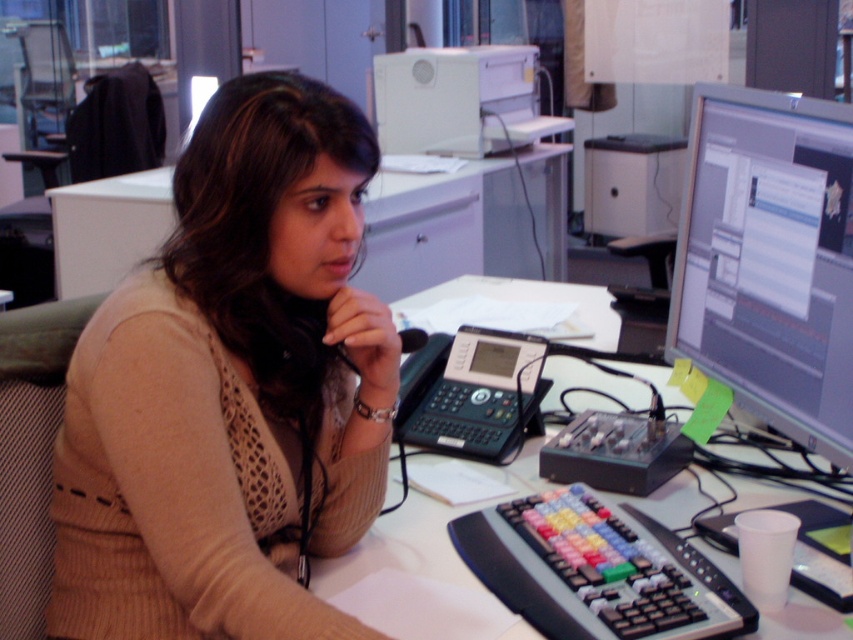
You are a delivery person who needs to place a small package on the white plastic table at center. The camera is positioned 1.01 meters away from the table. Can you safely place the package without moving the camera?

The white plastic table at center and camera are 1.01 meters apart from each other. Since the distance between them is exactly 1.01 meters, you can safely place the package on the white plastic table at center without disturbing the camera as long as you do not exceed that distance.

You are organizing an office space and need to place a new 12 inch by 12 inch square box on either the white plastic table at center or the white plastic printer at upper center. Based on their sizes, which surface can accommodate the box without overhanging?

The white plastic table at center has a larger size compared to the white plastic printer at upper center, so the box should be placed on the white plastic table at center to ensure it fits without overhanging.

You are organizing the desk items. The white glossy table at upper center and the multicolored plastic keyboard at lower center are both on the desk. Which object takes up more space on the desk?

The white glossy table at upper center takes up more space on the desk because it is larger in size than the multicolored plastic keyboard at lower center.